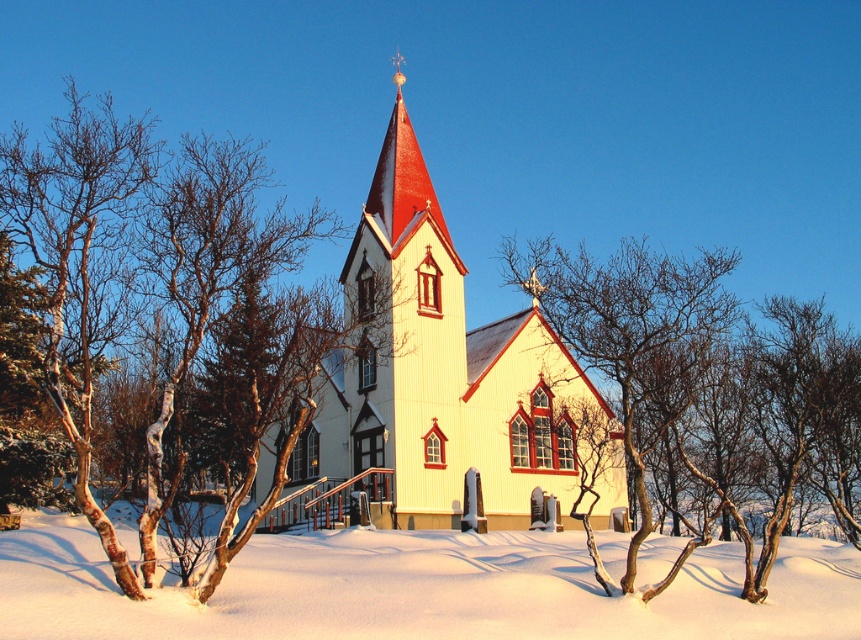
You are standing at a viewpoint and want to take a photo of the white wood church at center. If your camera has a maximum zoom range of 50 meters, can you capture the entire church in the photo without moving closer?

The white wood church at center is 69.80 meters away from the camera. Since the camera can only zoom up to 50 meters, you cannot capture the entire church in the photo without moving closer.

You are standing in front of the church and notice a point marked at coordinates [171,321]. What object is located at that point?

The white bark tree at center is located at point [171,321].